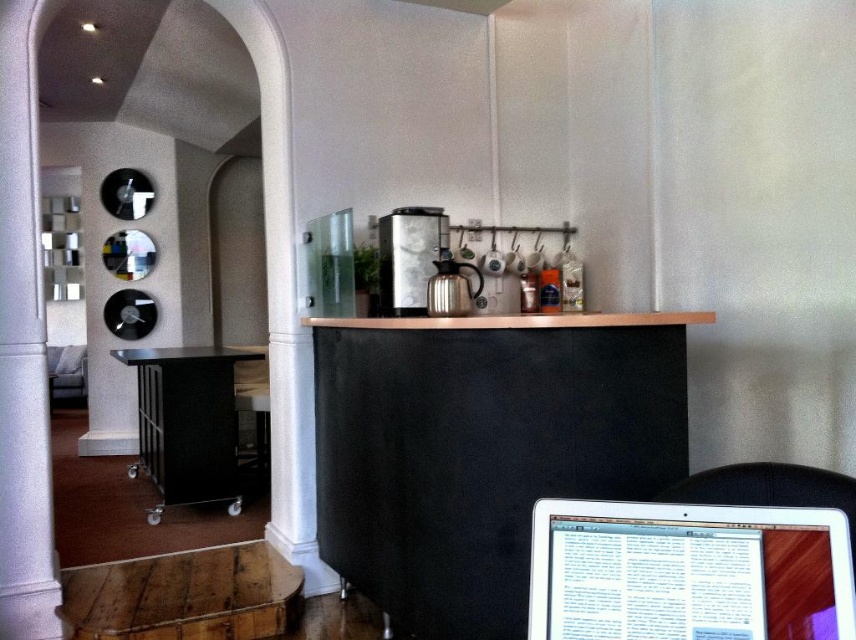
Based on the photo, can you confirm if white smooth pillar at left is bigger than satin silver coffee machine at center?

Incorrect, white smooth pillar at left is not larger than satin silver coffee machine at center.

Who is positioned more to the right, white smooth pillar at left or satin silver coffee machine at center?

satin silver coffee machine at center

The width and height of the screenshot is (856, 640). What do you see at coordinates (22, 346) in the screenshot? I see `white smooth pillar at left` at bounding box center [22, 346].

Where is `white smooth pillar at left`? The height and width of the screenshot is (640, 856). white smooth pillar at left is located at coordinates (22, 346).

In the scene shown: How much distance is there between white smooth pillar at left and black metal table at lower left?

1.68 meters

Between point (31, 364) and point (164, 472), which one is positioned in front?

Point (31, 364) is in front.

Between point (19, 470) and point (229, 500), which one is positioned behind?

The point (229, 500) is behind.

This screenshot has height=640, width=856. I want to click on white smooth pillar at left, so click(x=22, y=346).

Is point (649, 435) behind point (245, 396)?

No.

Does black suede table at center have a smaller size compared to black plastic stool at lower left?

No.

Measure the distance between black suede table at center and camera.

A distance of 2.10 meters exists between black suede table at center and camera.

The height and width of the screenshot is (640, 856). In order to click on black suede table at center in this screenshot , I will do `click(482, 449)`.